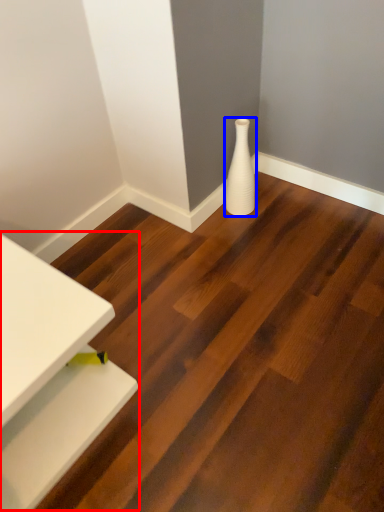
Question: Among these objects, which one is nearest to the camera, table (highlighted by a red box) or vase (highlighted by a blue box)?

Choices:
 (A) table
 (B) vase

Answer: (A)